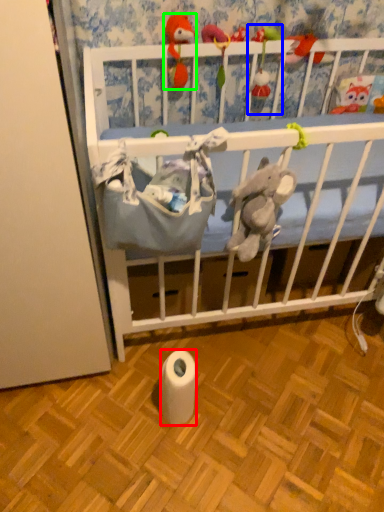
Question: Considering the real-world distances, which object is closest to toilet paper (highlighted by a red box)? toy (highlighted by a blue box) or toy (highlighted by a green box).

Choices:
 (A) toy
 (B) toy

Answer: (B)